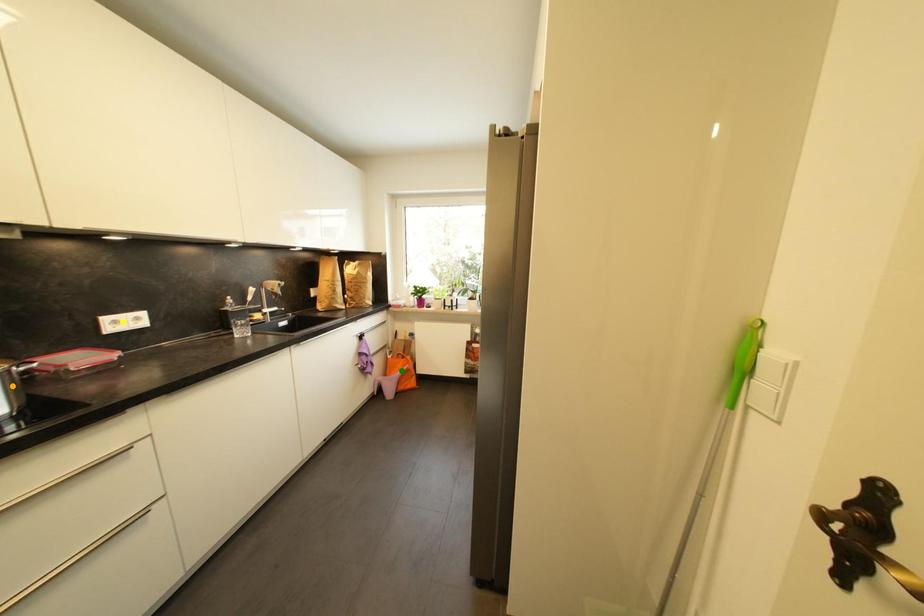
Order these from farthest to nearest:
1. orange point
2. green point
3. yellow point

green point
yellow point
orange point